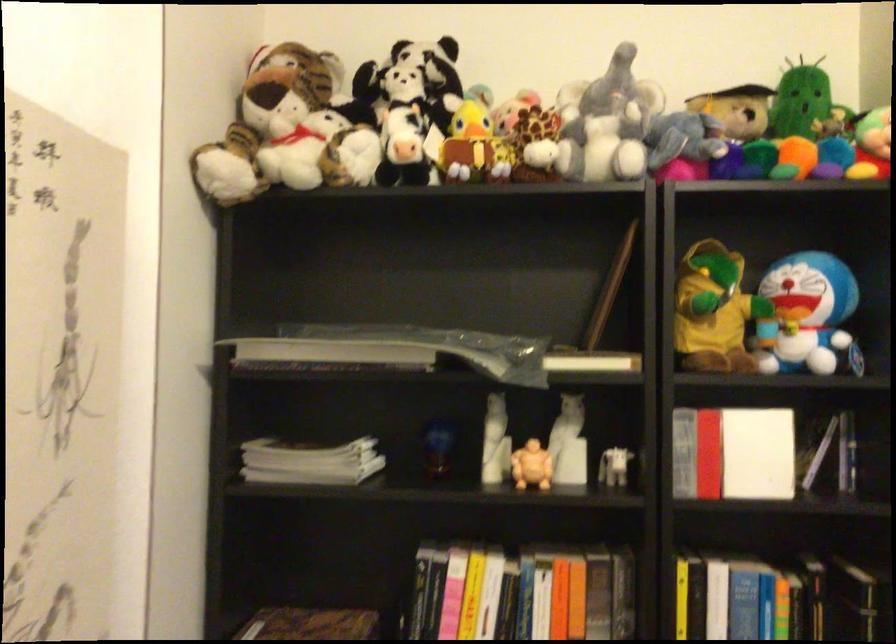
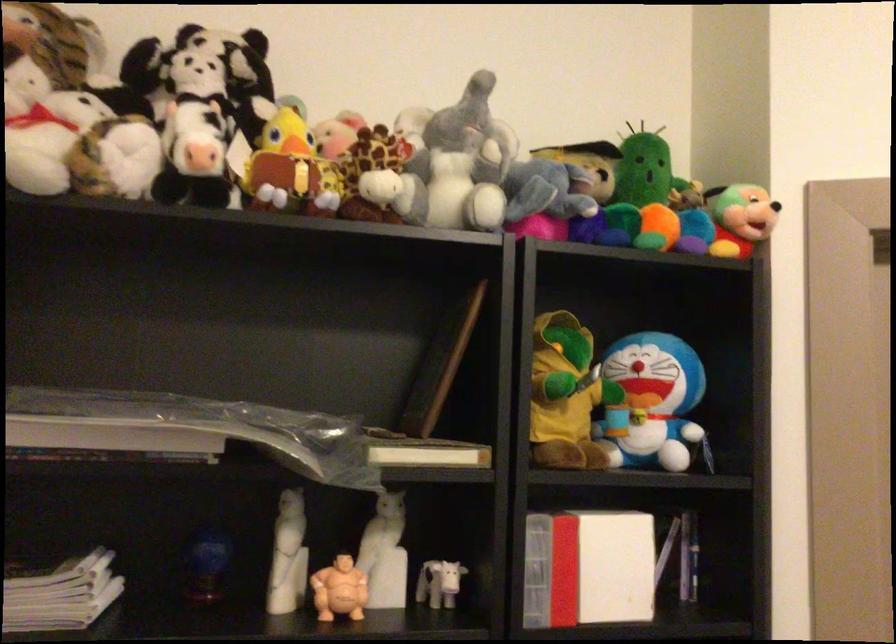
Locate, in the second image, the point that corresponds to point 492,144 in the first image.

(316, 169)